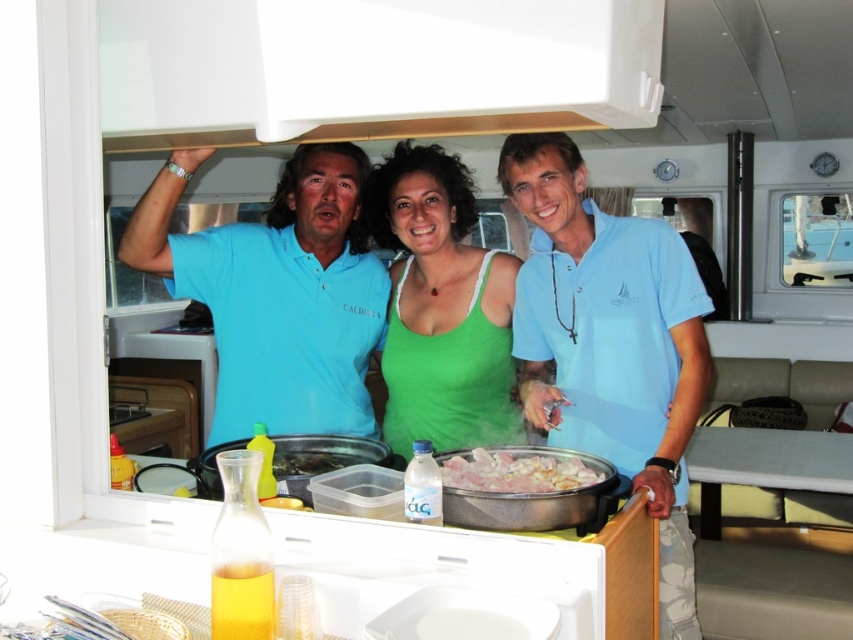
You are a photographer adjusting the camera height to ensure both the blue cotton shirt at upper left and the green fabric tank top at center are fully visible in the photo. Which person should you focus on adjusting the camera height for first?

The blue cotton shirt at upper left is shorter than the green fabric tank top at center, so you should adjust the camera height to accommodate the shorter blue cotton shirt at upper left first to ensure both are fully visible.